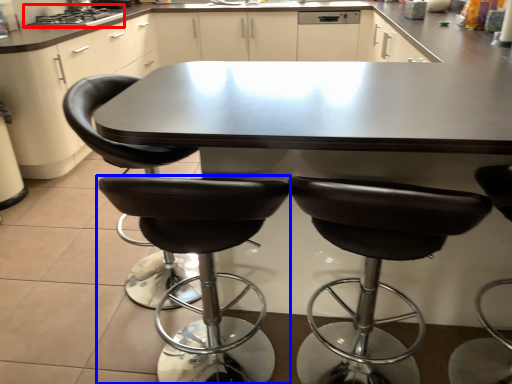
Question: Which object appears farthest to the camera in this image, stove (highlighted by a red box) or chair (highlighted by a blue box)?

Choices:
 (A) stove
 (B) chair

Answer: (A)